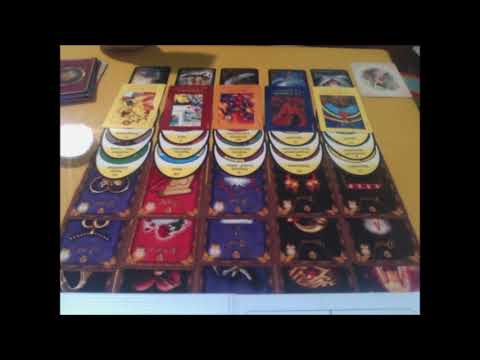
Locate an element on the screen. table is located at coordinates (385, 127).